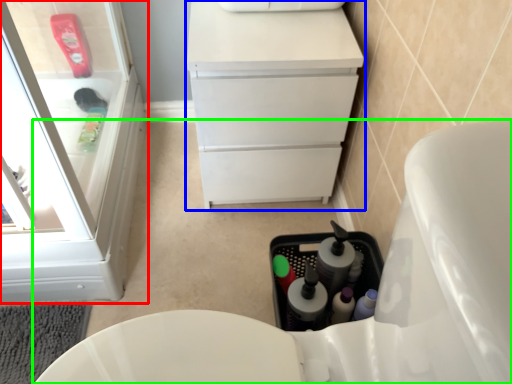
Question: Which is nearer to the bathroom cabinet (highlighted by a red box)? vanity (highlighted by a blue box) or toilet (highlighted by a green box).

Choices:
 (A) vanity
 (B) toilet

Answer: (A)